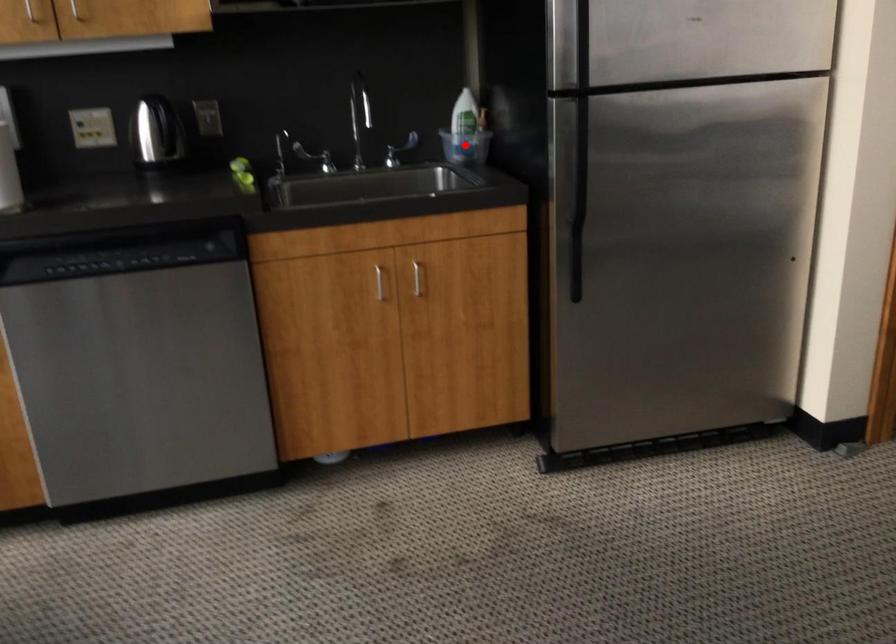
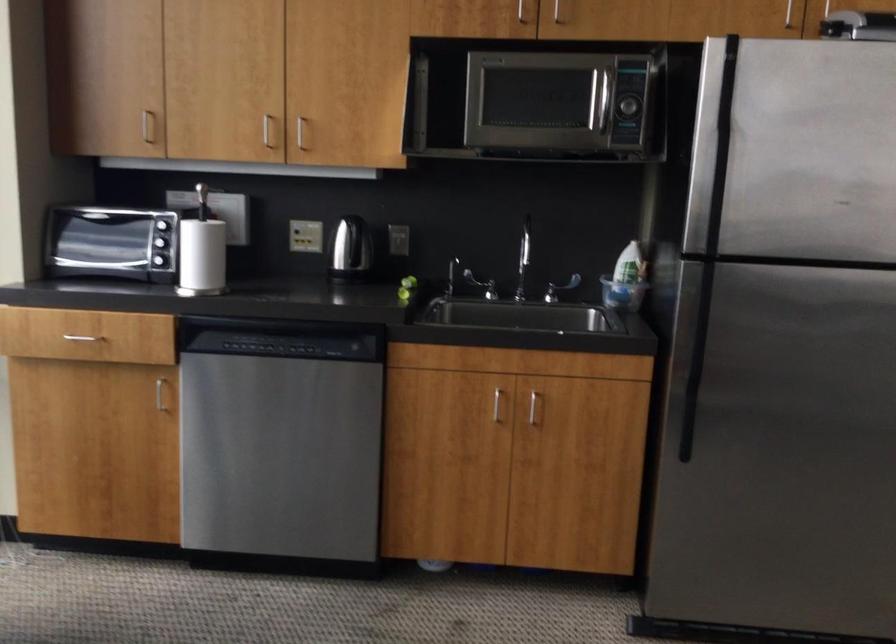
Where in the second image is the point corresponding to the highlighted location from the first image?

(622, 294)